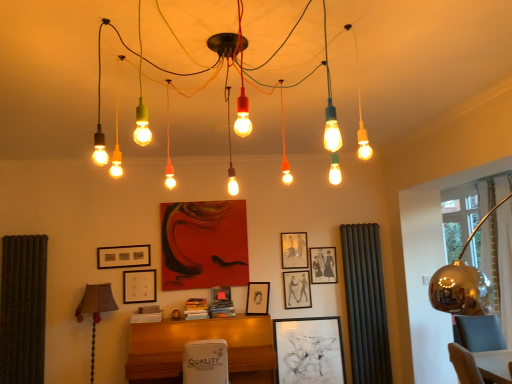
Question: In terms of size, does matte black picture frame at upper center, arranged as the 6th picture frame when viewed from the left, appear bigger or smaller than black matte picture frame at center, which ranks as the 2th picture frame in right-to-left order?

Choices:
 (A) small
 (B) big

Answer: (A)

Question: Considering their positions, is matte black picture frame at upper center, arranged as the 6th picture frame when viewed from the left, located in front of or behind black matte picture frame at center, which ranks as the 2th picture frame in right-to-left order?

Choices:
 (A) front
 (B) behind

Answer: (B)

Question: Considering the real-world distances, which object is farthest from the black fabric curtain at right?

Choices:
 (A) black matte picture frame at upper left, the 9th picture frame from the right
 (B) red matte painting at center, which is the third picture frame in left-to-right order
 (C) black matte picture frame at center, arranged as the 8th picture frame when viewed from the left
 (D) wooden desk at center
 (E) matte black picture frame at center, positioned as the third picture frame in right-to-left order

Answer: (A)

Question: Which object is the farthest from the multicolored glass bulbs at center?

Choices:
 (A) black fabric curtain at right
 (B) brown fabric lampshade at lower left
 (C) matte black picture frame at center, acting as the sixth picture frame starting from the right
 (D) wooden desk at center
 (E) matte black picture frame at center, the 5th picture frame positioned from the right

Answer: (A)